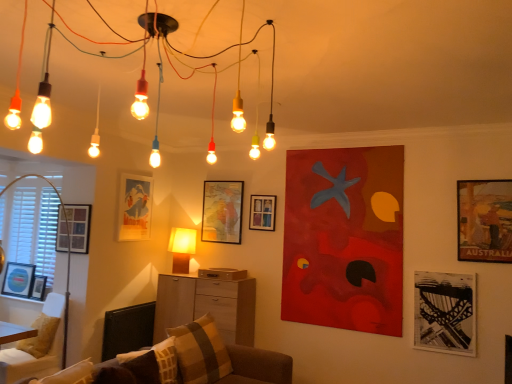
Question: Could you tell me if wooden cabinet at center is turned towards wooden textured poster at upper right, the 1th picture frame in the right-to-left sequence?

Choices:
 (A) no
 (B) yes

Answer: (A)

Question: From a real-world perspective, is wooden cabinet at center beneath wooden textured poster at upper right, the 1th picture frame in the right-to-left sequence?

Choices:
 (A) yes
 (B) no

Answer: (A)

Question: Is the position of wooden cabinet at center more distant than that of wooden textured poster at upper right, the 1th picture frame in the right-to-left sequence?

Choices:
 (A) no
 (B) yes

Answer: (B)

Question: Is wooden cabinet at center to the right of wooden textured poster at upper right, the 1th picture frame in the right-to-left sequence, from the viewer's perspective?

Choices:
 (A) yes
 (B) no

Answer: (B)

Question: From a real-world perspective, is wooden cabinet at center over wooden textured poster at upper right, the 1th picture frame in the right-to-left sequence?

Choices:
 (A) no
 (B) yes

Answer: (A)

Question: Is wooden cabinet at center smaller than wooden textured poster at upper right, the 1th picture frame in the right-to-left sequence?

Choices:
 (A) yes
 (B) no

Answer: (B)

Question: Does wooden cabinet at center contain matte blue picture frame at left, the first picture frame when ordered from left to right?

Choices:
 (A) no
 (B) yes

Answer: (A)

Question: Is wooden cabinet at center positioned beyond the bounds of matte blue picture frame at left, the 8th picture frame positioned from the right?

Choices:
 (A) yes
 (B) no

Answer: (A)

Question: Can you confirm if wooden cabinet at center is taller than matte blue picture frame at left, the first picture frame when ordered from left to right?

Choices:
 (A) yes
 (B) no

Answer: (A)

Question: From a real-world perspective, is wooden cabinet at center physically above matte blue picture frame at left, the first picture frame when ordered from left to right?

Choices:
 (A) no
 (B) yes

Answer: (A)

Question: Is wooden cabinet at center placed right next to matte blue picture frame at left, the first picture frame when ordered from left to right?

Choices:
 (A) no
 (B) yes

Answer: (A)

Question: Is wooden cabinet at center looking in the opposite direction of matte blue picture frame at left, the first picture frame when ordered from left to right?

Choices:
 (A) no
 (B) yes

Answer: (A)

Question: Is plush brown couch at lower center positioned in front of matte paper picture frame at upper left, which is counted as the fifth picture frame, starting from the right?

Choices:
 (A) yes
 (B) no

Answer: (A)